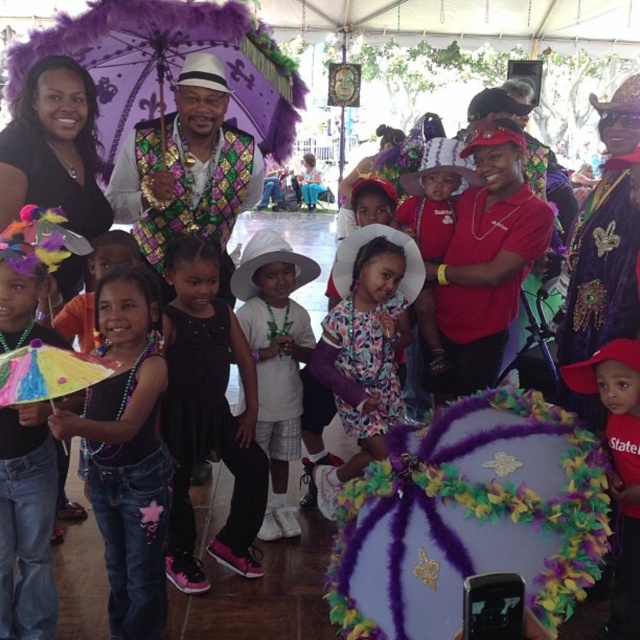
Question: Does white matte shirt at center appear over red cotton shirt at lower right?

Choices:
 (A) no
 (B) yes

Answer: (B)

Question: Where is floral-patterned dress at center located in relation to white matte shirt at center in the image?

Choices:
 (A) below
 (B) above

Answer: (A)

Question: Which object is farther from the camera taking this photo?

Choices:
 (A) white matte shirt at center
 (B) red cotton shirt at lower right
 (C) floral-patterned dress at center

Answer: (A)

Question: Which object is closer to the camera taking this photo?

Choices:
 (A) white matte shirt at center
 (B) red cotton shirt at lower right
 (C) floral-patterned dress at center

Answer: (B)

Question: From the image, what is the correct spatial relationship of purple feathered umbrella at upper left in relation to white matte shirt at center?

Choices:
 (A) below
 (B) above

Answer: (B)

Question: Estimate the real-world distances between objects in this image. Which object is closer to the purple feathered umbrella at upper left?

Choices:
 (A) black satin dress at center
 (B) white matte shirt at center
 (C) floral-patterned dress at center
 (D) red cotton shirt at lower right

Answer: (B)